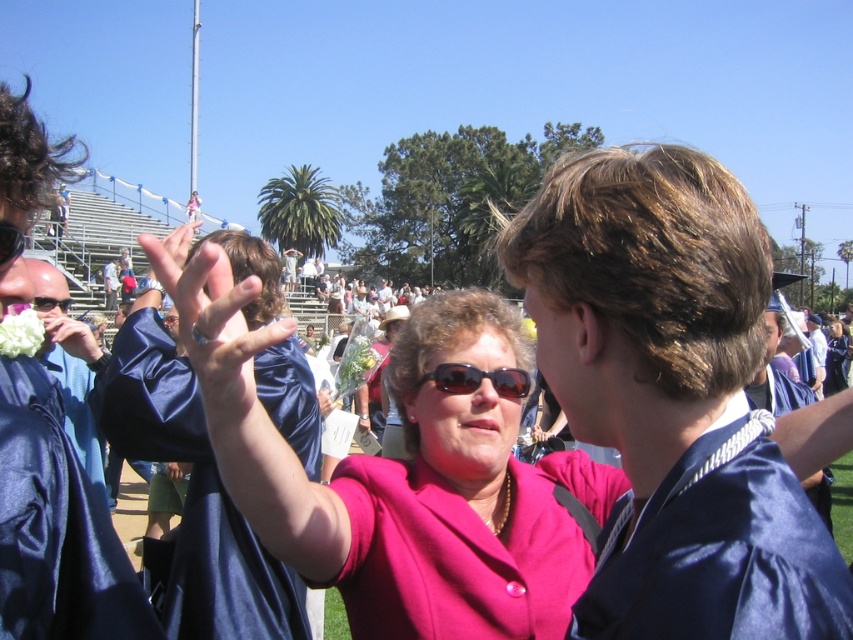
You are a photographer at the graduation ceremony. You need to capture a photo where both the black plastic sunglasses at center and the white fluffy flower at center are visible. Which object should you ensure is placed to the left in your camera frame?

The white fluffy flower at center should be placed to the left in your camera frame because the black plastic sunglasses at center is positioned on the right side of it.